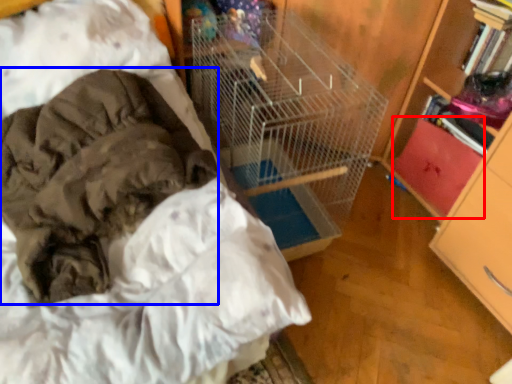
Question: Among these objects, which one is nearest to the camera, drawer (highlighted by a red box) or clothing (highlighted by a blue box)?

Choices:
 (A) drawer
 (B) clothing

Answer: (B)